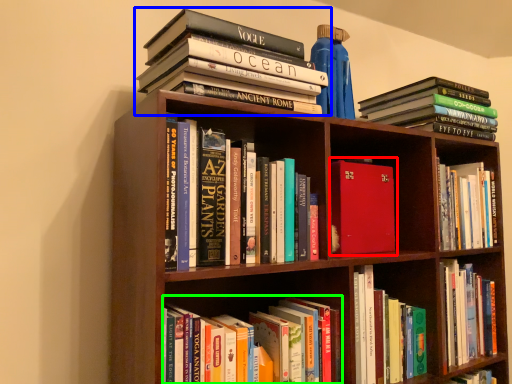
Question: Considering the real-world distances, which object is farthest from book (highlighted by a red box)? book (highlighted by a blue box) or book (highlighted by a green box)?

Choices:
 (A) book
 (B) book

Answer: (A)